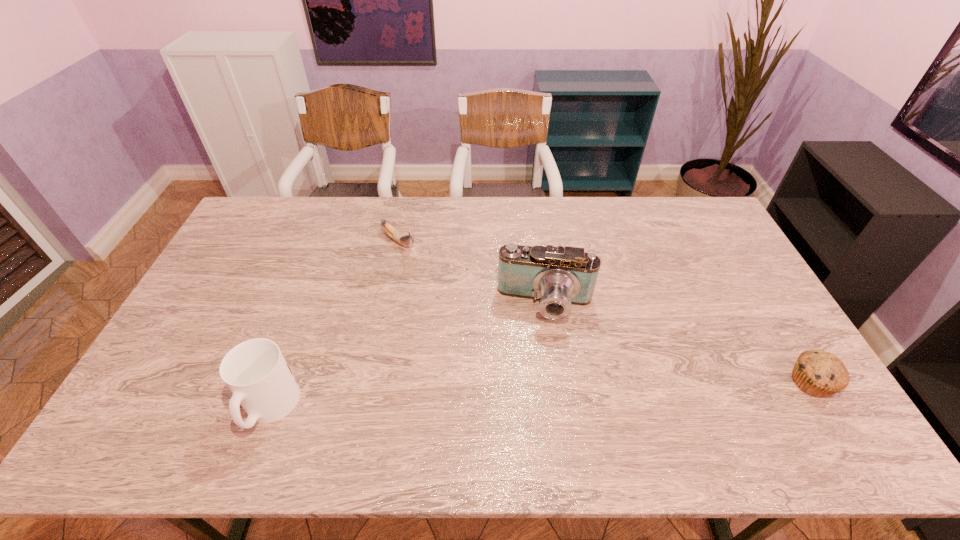
Locate an element on the screen. Image resolution: width=960 pixels, height=540 pixels. free space on the desktop that is between the mug and the muffin and is positioned on the front-facing side of the second object from right to left is located at coordinates (537, 395).

You are a GUI agent. You are given a task and a screenshot of the screen. Output one action in this format:
    pyautogui.click(x=<x>, y=<y>)
    Task: Click on the free space on the desktop that is between the mug and the muffin and is positioned at the stem of the third object from right to left
    The height and width of the screenshot is (540, 960).
    Given the screenshot: What is the action you would take?
    pyautogui.click(x=604, y=392)